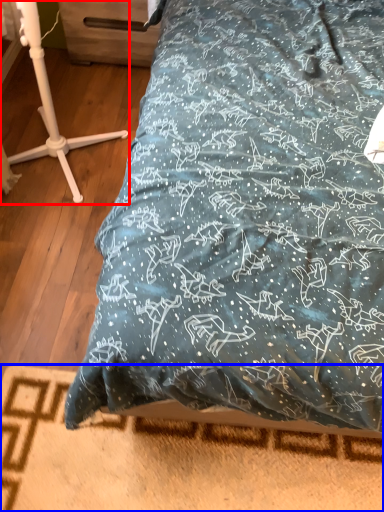
Question: Which object is closer to the camera taking this photo, furniture (highlighted by a red box) or bed frame (highlighted by a blue box)?

Choices:
 (A) furniture
 (B) bed frame

Answer: (A)